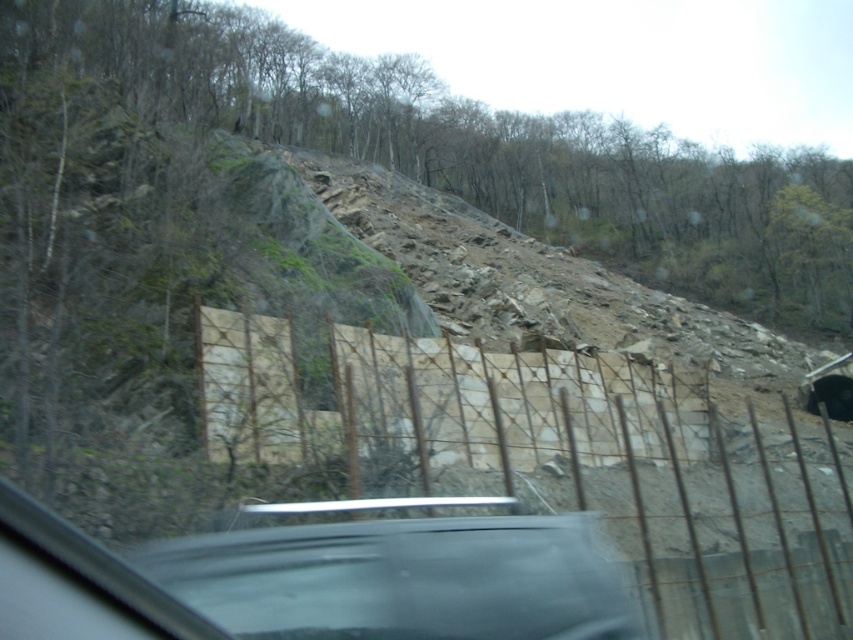
Identify the location of brown woven wire fence at center. This screenshot has height=640, width=853. (564, 461).

Is point (643, 404) farther from viewer compared to point (634, 138)?

No, (643, 404) is in front of (634, 138).

The width and height of the screenshot is (853, 640). In order to click on brown woven wire fence at center in this screenshot , I will do `click(564, 461)`.